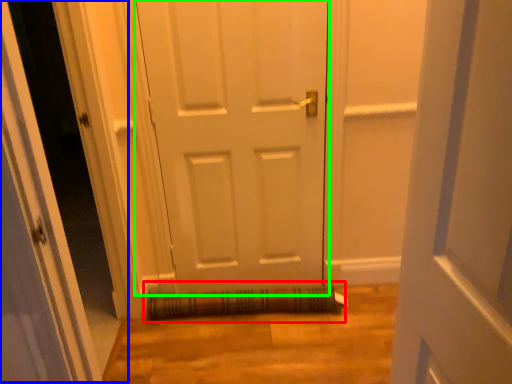
Question: Which object is the closest to the doormat (highlighted by a red box)? Choose among these: glass door (highlighted by a blue box) or door (highlighted by a green box).

Choices:
 (A) glass door
 (B) door

Answer: (B)